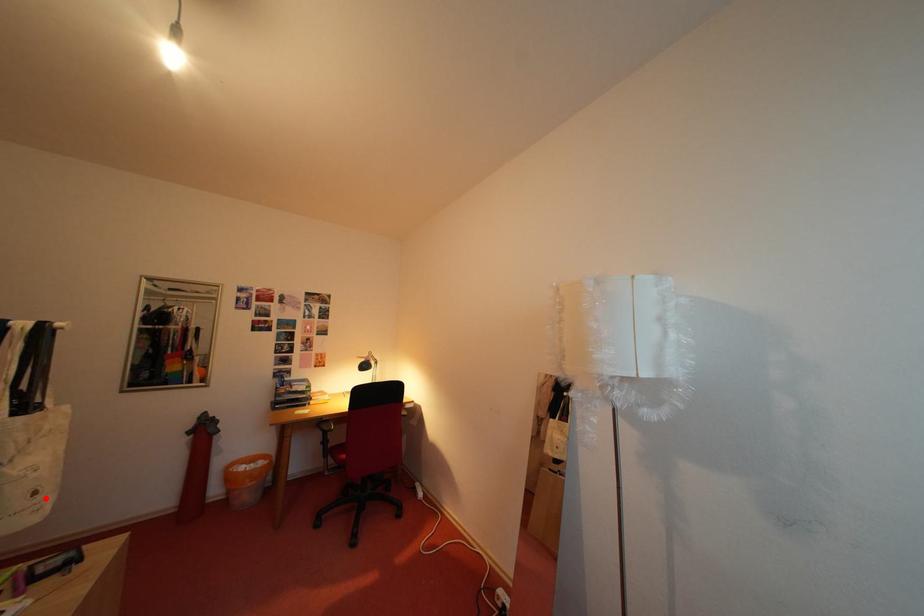
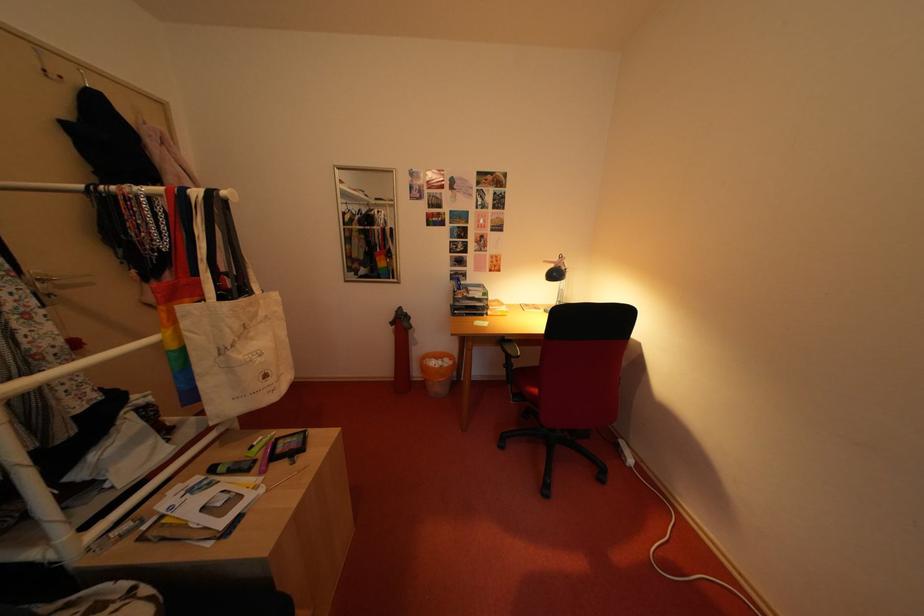
Where in the second image is the point corresponding to the highlighted location from the first image?

(275, 381)